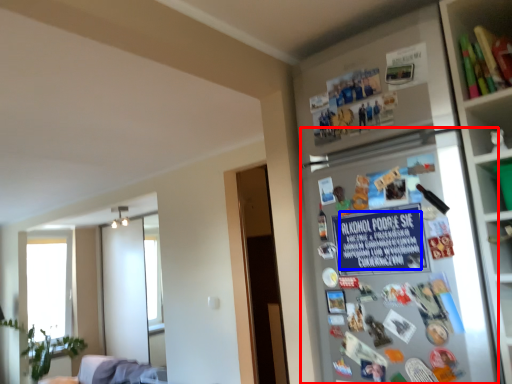
Question: Which point is further to the camera, fridge (highlighted by a red box) or writing (highlighted by a blue box)?

Choices:
 (A) fridge
 (B) writing

Answer: (B)